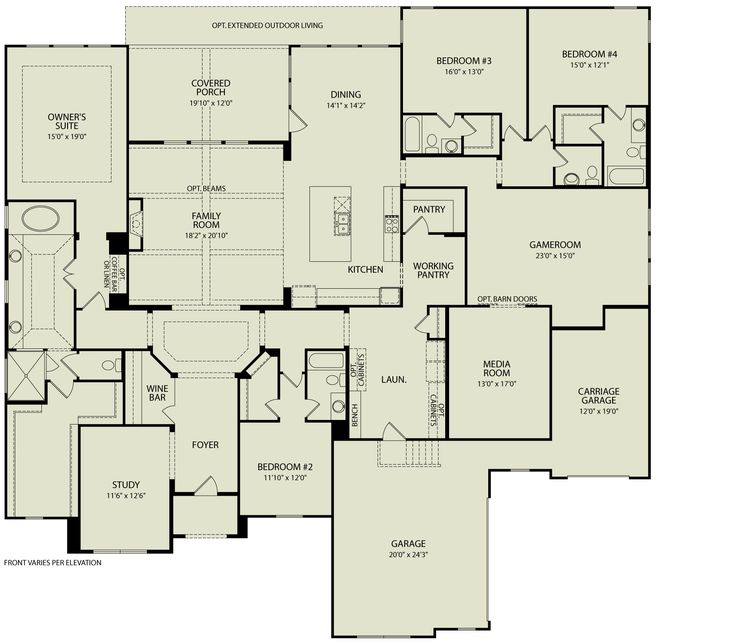
At what (x,y) coordinates should I click in order to perform the action: click on living areas. Please return your answer as a coordinate pair (x, y). The image size is (736, 643). Looking at the image, I should click on (244, 77), (77, 105), (210, 218), (347, 93), (467, 56), (586, 57), (537, 262), (500, 367), (276, 480), (121, 478).